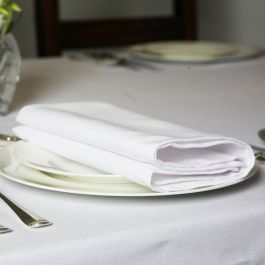
I want to click on white tablecloth, so click(x=170, y=100), click(x=229, y=223).